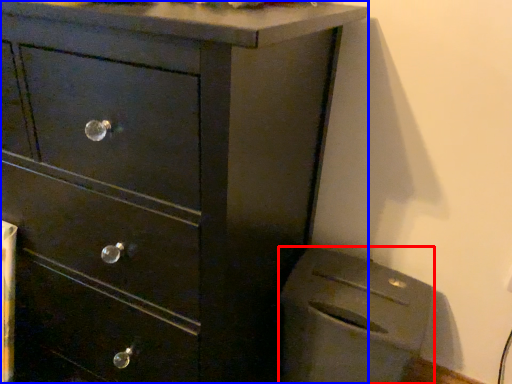
Question: Which object is closer to the camera taking this photo, appliance (highlighted by a red box) or chest of drawers (highlighted by a blue box)?

Choices:
 (A) appliance
 (B) chest of drawers

Answer: (B)